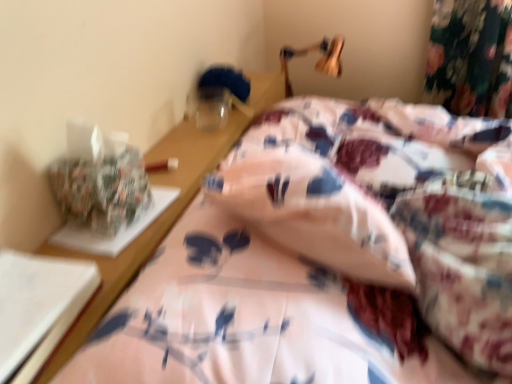
The image size is (512, 384). What do you see at coordinates (318, 60) in the screenshot? I see `wooden table lamp at upper center` at bounding box center [318, 60].

In order to face wooden table lamp at upper center, should I rotate leftwards or rightwards?

To face it directly, rotate right by 6.860 degrees.

The width and height of the screenshot is (512, 384). I want to click on wooden table lamp at upper center, so click(318, 60).

What do you see at coordinates (328, 257) in the screenshot?
I see `floral fabric bed at center` at bounding box center [328, 257].

Measure the distance between floral fabric bed at center and camera.

A distance of 17.91 inches exists between floral fabric bed at center and camera.

Where is `floral fabric bed at center`? This screenshot has height=384, width=512. floral fabric bed at center is located at coordinates (328, 257).

Where is `wooden table lamp at upper center`? This screenshot has width=512, height=384. wooden table lamp at upper center is located at coordinates (318, 60).

Can you confirm if floral fabric bed at center is positioned to the left of wooden table lamp at upper center?

Indeed, floral fabric bed at center is positioned on the left side of wooden table lamp at upper center.

Is floral fabric bed at center positioned behind wooden table lamp at upper center?

No, it is not.

Which point is more distant from viewer, (115, 345) or (286, 57)?

The point (286, 57) is more distant.

From the image's perspective, which is above, floral fabric bed at center or wooden table lamp at upper center?

wooden table lamp at upper center is shown above in the image.

From a real-world perspective, relative to wooden table lamp at upper center, is floral fabric bed at center vertically above or below?

Clearly, from a real-world perspective, floral fabric bed at center is above wooden table lamp at upper center.

Is floral fabric bed at center wider or thinner than wooden table lamp at upper center?

floral fabric bed at center is wider than wooden table lamp at upper center.

Can you confirm if floral fabric bed at center is shorter than wooden table lamp at upper center?

Yes.

Considering the sizes of floral fabric bed at center and wooden table lamp at upper center in the image, is floral fabric bed at center bigger or smaller than wooden table lamp at upper center?

Considering their sizes, floral fabric bed at center takes up more space than wooden table lamp at upper center.

Is floral fabric bed at center not within wooden table lamp at upper center?

That's correct, floral fabric bed at center is outside of wooden table lamp at upper center.

Is there a large distance between floral fabric bed at center and wooden table lamp at upper center?

Absolutely, floral fabric bed at center is distant from wooden table lamp at upper center.

Could you tell me if floral fabric bed at center is facing wooden table lamp at upper center?

No.

Looking at this image, how many degrees apart are the facing directions of floral fabric bed at center and wooden table lamp at upper center?

The angle between the facing direction of floral fabric bed at center and the facing direction of wooden table lamp at upper center is 0.649 degrees.

At what (x,y) coordinates should I click in order to perform the action: click on bed on the left side of wooden table lamp at upper center. Please return your answer as a coordinate pair (x, y). This screenshot has width=512, height=384. Looking at the image, I should click on (328, 257).

Which is more to the left, wooden table lamp at upper center or floral fabric bed at center?

floral fabric bed at center.

Which is behind, wooden table lamp at upper center or floral fabric bed at center?

wooden table lamp at upper center is behind.

Which point is more distant from viewer, (340, 52) or (193, 267)?

The point (340, 52) is behind.

From the image's perspective, which one is positioned lower, wooden table lamp at upper center or floral fabric bed at center?

From the image's view, floral fabric bed at center is below.

From a real-world perspective, is wooden table lamp at upper center above or below floral fabric bed at center?

From a real-world perspective, wooden table lamp at upper center is physically below floral fabric bed at center.

Considering the relative sizes of wooden table lamp at upper center and floral fabric bed at center in the image provided, is wooden table lamp at upper center wider than floral fabric bed at center?

No, wooden table lamp at upper center is not wider than floral fabric bed at center.

Considering the sizes of objects wooden table lamp at upper center and floral fabric bed at center in the image provided, who is shorter, wooden table lamp at upper center or floral fabric bed at center?

floral fabric bed at center is shorter.

Is wooden table lamp at upper center smaller than floral fabric bed at center?

Indeed, wooden table lamp at upper center has a smaller size compared to floral fabric bed at center.

Is wooden table lamp at upper center not inside floral fabric bed at center?

Yes, wooden table lamp at upper center is not within floral fabric bed at center.

Is wooden table lamp at upper center next to floral fabric bed at center and touching it?

No, wooden table lamp at upper center is not in contact with floral fabric bed at center.

Does wooden table lamp at upper center turn towards floral fabric bed at center?

No, wooden table lamp at upper center is not facing towards floral fabric bed at center.

What are the coordinates of `table lamp behind the floral fabric bed at center` in the screenshot? It's located at (318, 60).

Locate an element on the screen. The width and height of the screenshot is (512, 384). table lamp on the right of floral fabric bed at center is located at coordinates (318, 60).

Locate an element on the screen. This screenshot has height=384, width=512. table lamp located behind the floral fabric bed at center is located at coordinates (318, 60).